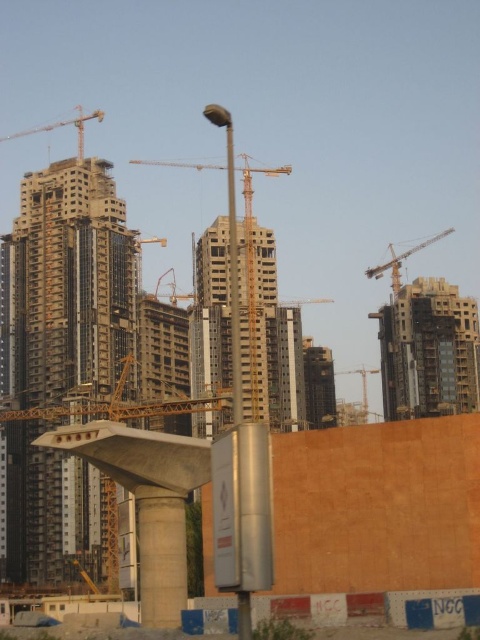
Is point (456, 376) farther from camera compared to point (391, 268)?

No.

At what (x,y) coordinates should I click in order to perform the action: click on concrete building at right. Please return your answer as a coordinate pair (x, y). Looking at the image, I should click on (429, 349).

Locate an element on the screen. Image resolution: width=480 pixels, height=640 pixels. concrete building at right is located at coordinates (429, 349).

Does concrete building at right have a lesser width compared to metallic yellow crane at center?

Incorrect, concrete building at right's width is not less than metallic yellow crane at center's.

Describe the element at coordinates (429, 349) in the screenshot. This screenshot has width=480, height=640. I see `concrete building at right` at that location.

I want to click on concrete building at right, so click(x=429, y=349).

Is point (204, 419) behind point (4, 140)?

No, (204, 419) is in front of (4, 140).

Does concrete building at center have a greater height compared to metallic construction crane at upper left?

Correct, concrete building at center is much taller as metallic construction crane at upper left.

In the scene shown: Measure the distance between point (228, 273) and camera.

Point (228, 273) and camera are 159.17 meters apart.

Locate an element on the screen. Image resolution: width=480 pixels, height=640 pixels. concrete building at center is located at coordinates (212, 312).